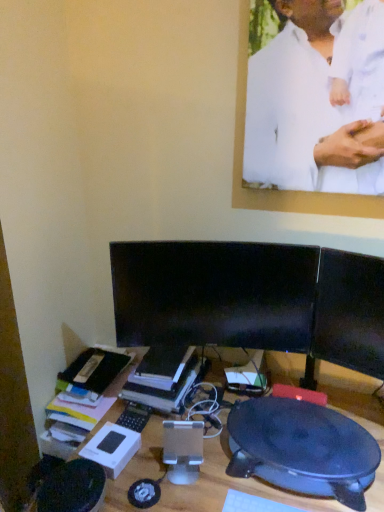
Question: Does hardcover book at center come in front of black glossy monitor at center, positioned as the first computer monitor in right-to-left order?

Choices:
 (A) yes
 (B) no

Answer: (B)

Question: Considering the relative sizes of hardcover book at center and black glossy monitor at center, positioned as the first computer monitor in right-to-left order, in the image provided, is hardcover book at center bigger than black glossy monitor at center, positioned as the first computer monitor in right-to-left order,?

Choices:
 (A) yes
 (B) no

Answer: (A)

Question: Is hardcover book at center not within black glossy monitor at center, positioned as the first computer monitor in right-to-left order?

Choices:
 (A) yes
 (B) no

Answer: (A)

Question: Does hardcover book at center have a lesser height compared to black glossy monitor at center, which is the second computer monitor in left-to-right order?

Choices:
 (A) no
 (B) yes

Answer: (B)

Question: Is black glossy monitor at center, which is the second computer monitor in left-to-right order, a part of hardcover book at center?

Choices:
 (A) no
 (B) yes

Answer: (A)

Question: From a real-world perspective, relative to hardcover book at center, is black glossy monitor at center, positioned as the first computer monitor in right-to-left order, vertically above or below?

Choices:
 (A) above
 (B) below

Answer: (A)

Question: Considering their positions, is black glossy monitor at center, positioned as the first computer monitor in right-to-left order, located in front of or behind hardcover book at center?

Choices:
 (A) behind
 (B) front

Answer: (B)

Question: Based on their sizes in the image, would you say black glossy monitor at center, positioned as the first computer monitor in right-to-left order, is bigger or smaller than hardcover book at center?

Choices:
 (A) big
 (B) small

Answer: (B)

Question: Considering the positions of black glossy monitor at center, positioned as the first computer monitor in right-to-left order, and hardcover book at center in the image, is black glossy monitor at center, positioned as the first computer monitor in right-to-left order, taller or shorter than hardcover book at center?

Choices:
 (A) short
 (B) tall

Answer: (B)

Question: From a real-world perspective, is black plastic round table at lower right physically located above or below black glossy monitor at center, positioned as the first computer monitor in right-to-left order?

Choices:
 (A) below
 (B) above

Answer: (A)

Question: From the image's perspective, relative to black glossy monitor at center, which is the second computer monitor in left-to-right order, is black plastic round table at lower right above or below?

Choices:
 (A) below
 (B) above

Answer: (A)

Question: Considering the positions of black plastic round table at lower right and black glossy monitor at center, positioned as the first computer monitor in right-to-left order, in the image, is black plastic round table at lower right taller or shorter than black glossy monitor at center, positioned as the first computer monitor in right-to-left order,?

Choices:
 (A) tall
 (B) short

Answer: (B)

Question: Is point (258, 451) closer or farther from the camera than point (360, 307)?

Choices:
 (A) farther
 (B) closer

Answer: (B)

Question: Is white matte shirt at upper center to the left or to the right of black plastic desk at center in the image?

Choices:
 (A) left
 (B) right

Answer: (B)

Question: In terms of height, does white matte shirt at upper center look taller or shorter compared to black plastic desk at center?

Choices:
 (A) short
 (B) tall

Answer: (A)